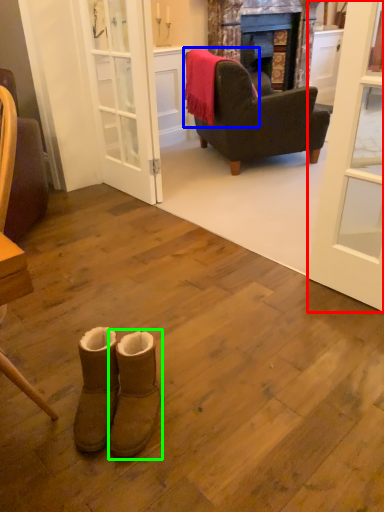
Question: Estimate the real-world distances between objects in this image. Which object is farther from door (highlighted by a red box), blanket (highlighted by a blue box) or footwear (highlighted by a green box)?

Choices:
 (A) blanket
 (B) footwear

Answer: (A)